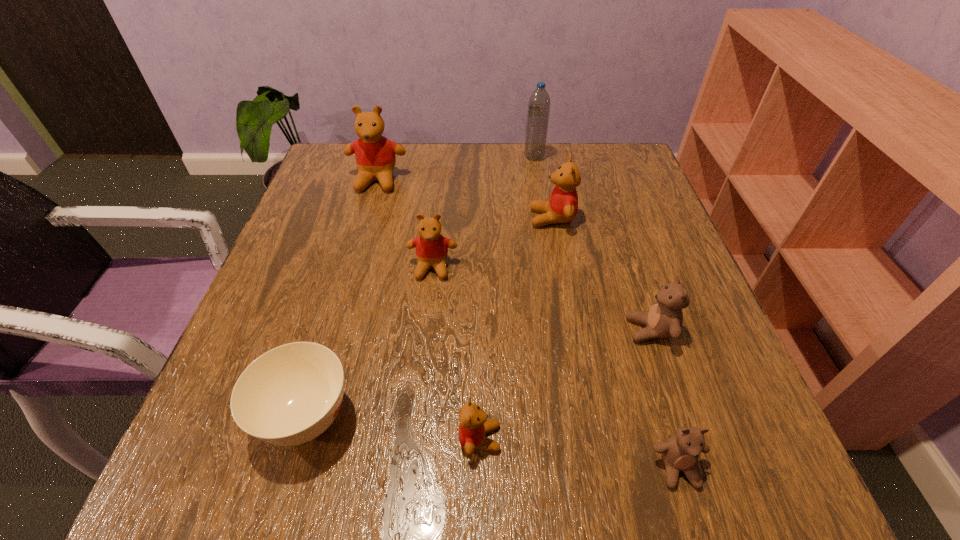
Identify the location of the farthest object. (539, 102).

I want to click on blue water bottle, so click(539, 102).

This screenshot has height=540, width=960. Identify the location of the biggest red teddy bear. tap(375, 155).

The image size is (960, 540). I want to click on the tallest teddy bear, so click(x=375, y=155).

What are the coordinates of `the third tallest object` in the screenshot? It's located at (562, 207).

The width and height of the screenshot is (960, 540). In order to click on the fifth nearest teddy bear in this screenshot , I will do `click(562, 207)`.

Where is `the sixth object from right to left`? the sixth object from right to left is located at coordinates (431, 247).

At what (x,y) coordinates should I click in order to perform the action: click on the fifth nearest object. Please return your answer as a coordinate pair (x, y). Looking at the image, I should click on (431, 247).

Identify the location of the fourth farthest teddy bear. This screenshot has height=540, width=960. (664, 319).

This screenshot has height=540, width=960. Identify the location of the farther brown teddy bear. (664, 319).